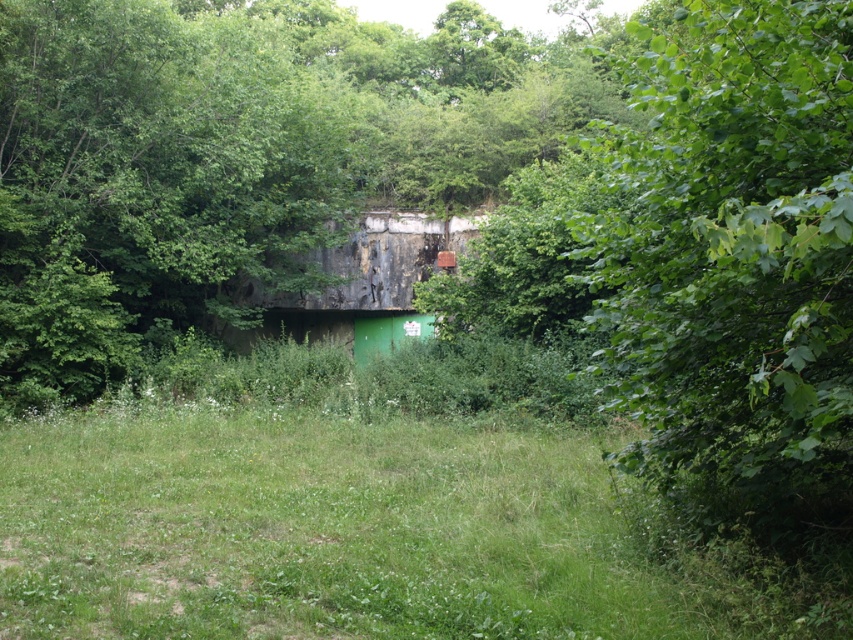
Does green grass at center have a greater width compared to green leafy tree at right?

Correct, the width of green grass at center exceeds that of green leafy tree at right.

Between point (3, 596) and point (670, 90), which one is positioned in front?

Point (670, 90) is in front.

Which is in front, point (550, 529) or point (653, 161)?

Point (653, 161) is in front.

The height and width of the screenshot is (640, 853). I want to click on green grass at center, so click(340, 532).